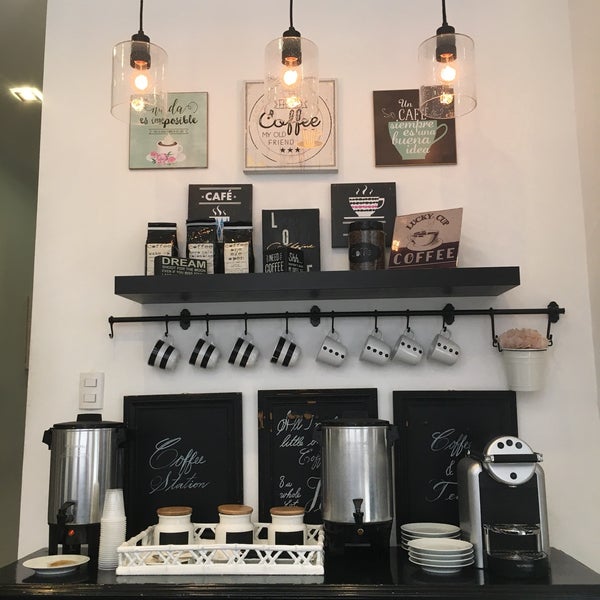
This screenshot has width=600, height=600. Identify the location of black and white striped ceramic mugs. (160, 344), (203, 341), (240, 342), (283, 340).